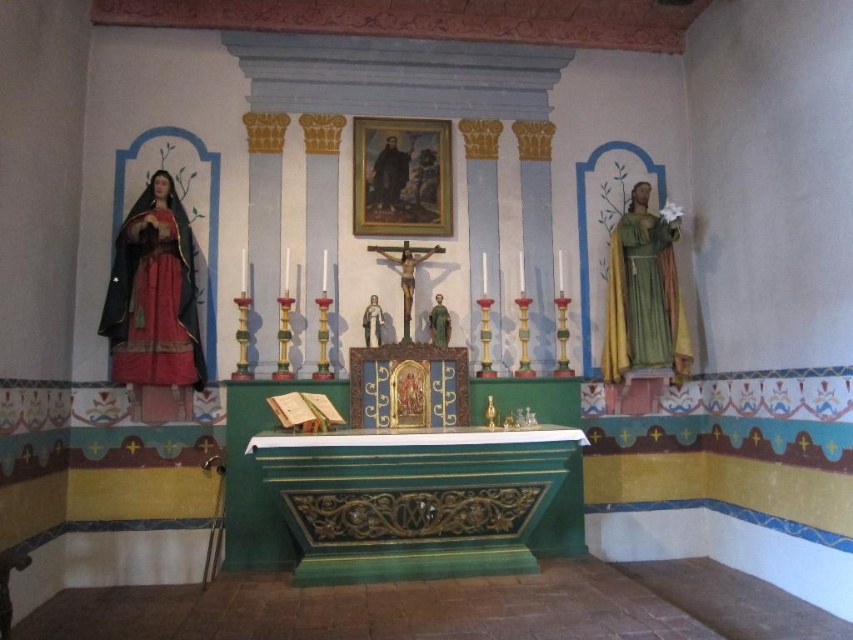
You are an interior designer planning to add a new shelf above the altar. The shelf must accommodate both the matte green statue at right and the wooden crucifix at center. Based on their sizes, which object should be placed on the shelf first to ensure it fits properly?

The matte green statue at right is taller than the wooden crucifix at center, so you should place the matte green statue at right first to ensure the shelf can accommodate its height.

Looking at this image, you are standing in the chapel and want to place a small offering at the base of the matte black statue at left. Based on its position, which direction should you move from the altar to reach it?

The matte black statue at left is located at point (154, 307), which means it is positioned to the left of the altar. Therefore, you should move to the left side of the altar to place your offering.